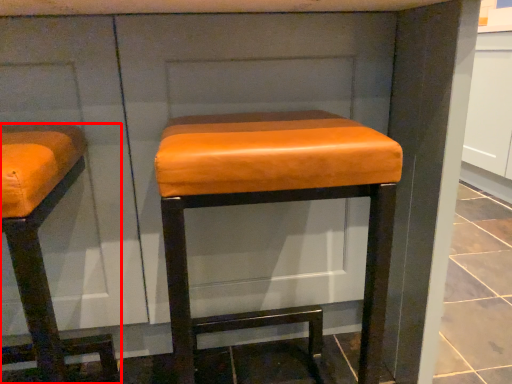
Question: From the image, what is the correct spatial relationship of furniture (annotated by the red box) in relation to stool?

Choices:
 (A) right
 (B) left

Answer: (B)